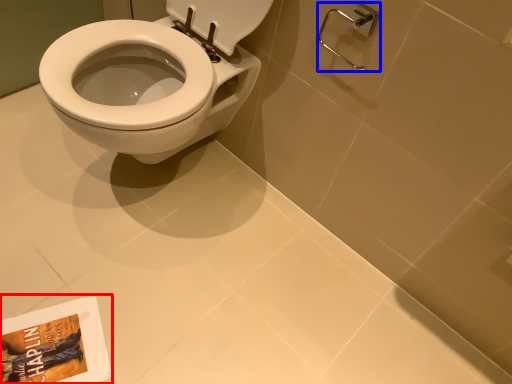
Question: Which object appears closest to the camera in this image, paperback book (highlighted by a red box) or shower (highlighted by a blue box)?

Choices:
 (A) paperback book
 (B) shower

Answer: (B)